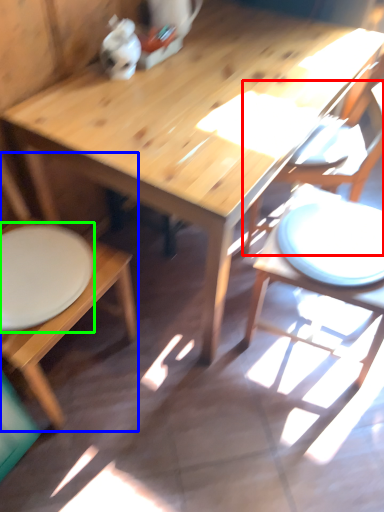
Question: Which object is the farthest from chair (highlighted by a red box)? Choose among these: chair (highlighted by a blue box) or plate (highlighted by a green box).

Choices:
 (A) chair
 (B) plate

Answer: (A)